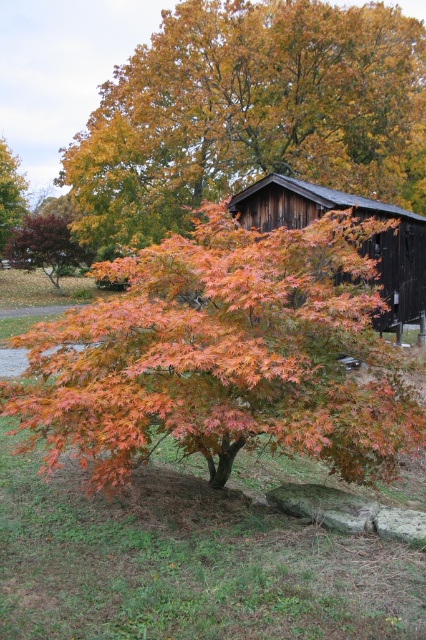
Between dark brown wooden barn at center and smooth reddish-brown tree at upper left, which one is positioned lower?

dark brown wooden barn at center is below.

At what (x,y) coordinates should I click in order to perform the action: click on dark brown wooden barn at center. Please return your answer as a coordinate pair (x, y). The image size is (426, 640). Looking at the image, I should click on tap(362, 243).

Which is above, orange glossy leaves at center or dark brown wooden barn at center?

dark brown wooden barn at center is higher up.

Is orange glossy leaves at center to the left of dark brown wooden barn at center from the viewer's perspective?

Yes, orange glossy leaves at center is to the left of dark brown wooden barn at center.

Who is more forward, (173, 340) or (393, 275)?

Positioned in front is point (173, 340).

At what (x,y) coordinates should I click in order to perform the action: click on orange glossy leaves at center. Please return your answer as a coordinate pair (x, y). Looking at the image, I should click on (224, 356).

Who is higher up, orange glossy leaves at center or smooth reddish-brown tree at upper left?

Positioned higher is smooth reddish-brown tree at upper left.

Who is more distant from viewer, (134, 323) or (42, 259)?

The point (42, 259) is behind.

Which is in front, point (183, 396) or point (25, 266)?

Positioned in front is point (183, 396).

You are a GUI agent. You are given a task and a screenshot of the screen. Output one action in this format:
    pyautogui.click(x=<x>, y=<y>)
    Task: Click on the orange glossy leaves at center
    The image size is (426, 640).
    Given the screenshot: What is the action you would take?
    pyautogui.click(x=224, y=356)